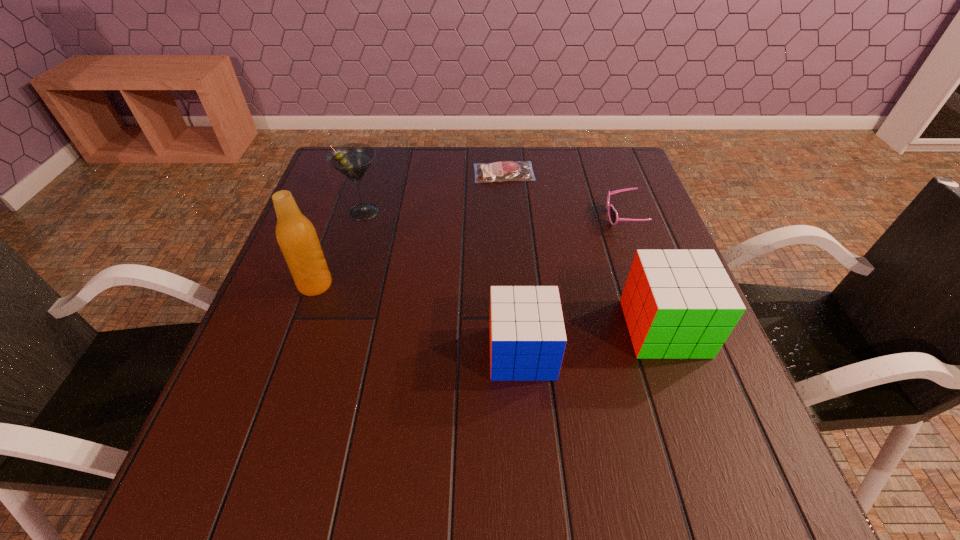
Locate an element on the screen. the fourth tallest object is located at coordinates (527, 334).

At what (x,y) coordinates should I click in order to perform the action: click on the shorter cube. Please return your answer as a coordinate pair (x, y). This screenshot has width=960, height=540. Looking at the image, I should click on (527, 334).

You are a GUI agent. You are given a task and a screenshot of the screen. Output one action in this format:
    pyautogui.click(x=<x>, y=<y>)
    Task: Click on the third tallest object
    The width and height of the screenshot is (960, 540).
    Given the screenshot: What is the action you would take?
    pyautogui.click(x=678, y=304)

This screenshot has width=960, height=540. Identify the location of the taller cube. (678, 304).

You are a GUI agent. You are given a task and a screenshot of the screen. Output one action in this format:
    pyautogui.click(x=<x>, y=<y>)
    Task: Click on the steak
    The width and height of the screenshot is (960, 540).
    Given the screenshot: What is the action you would take?
    pyautogui.click(x=501, y=171)

I want to click on the farthest object, so click(x=501, y=171).

Find the location of a particular element. the second shortest object is located at coordinates (612, 213).

Locate an element on the screen. This screenshot has width=960, height=540. martini is located at coordinates (352, 160).

Find the location of a particular element. This screenshot has width=960, height=540. beer bottle is located at coordinates (297, 238).

Locate an element on the screen. The width and height of the screenshot is (960, 540). the tallest object is located at coordinates point(297,238).